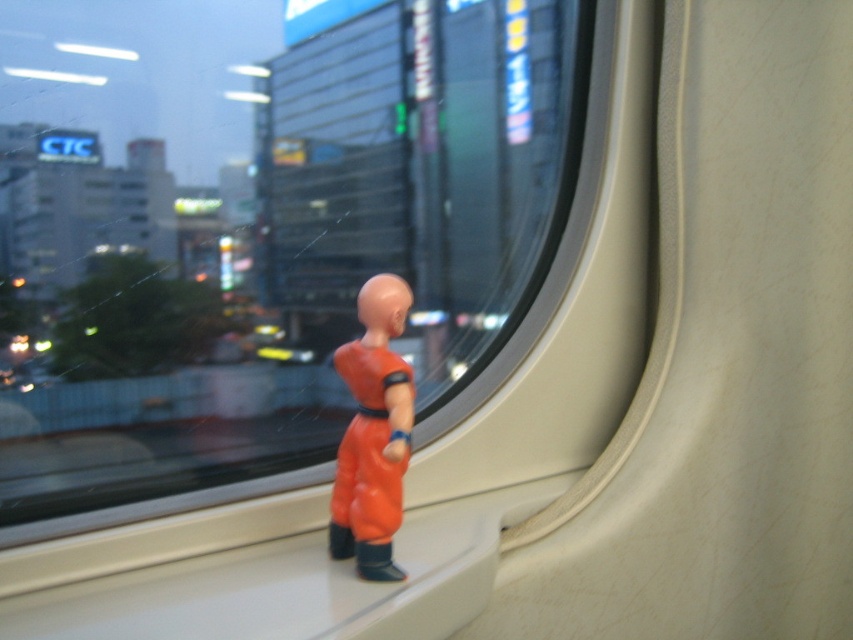
Does transparent plastic train window at center have a lesser width compared to orange matte figure at center?

No, transparent plastic train window at center is not thinner than orange matte figure at center.

Does transparent plastic train window at center appear over orange matte figure at center?

Yes, transparent plastic train window at center is above orange matte figure at center.

Between point (30, 218) and point (354, 422), which one is positioned in front?

Positioned in front is point (354, 422).

This screenshot has width=853, height=640. I want to click on transparent plastic train window at center, so click(x=299, y=253).